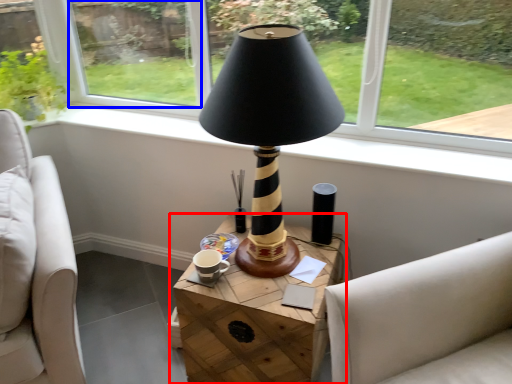
Question: Among these objects, which one is farthest to the camera, table (highlighted by a red box) or window screen (highlighted by a blue box)?

Choices:
 (A) table
 (B) window screen

Answer: (B)